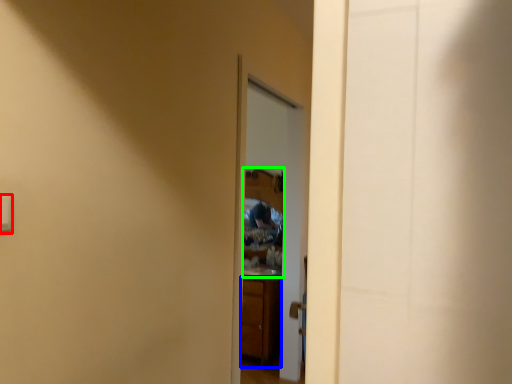
Question: Which object is positioned closest to light switch (highlighted by a red box)? Select from cabinetry (highlighted by a blue box) and mirror (highlighted by a green box).

Choices:
 (A) cabinetry
 (B) mirror

Answer: (A)